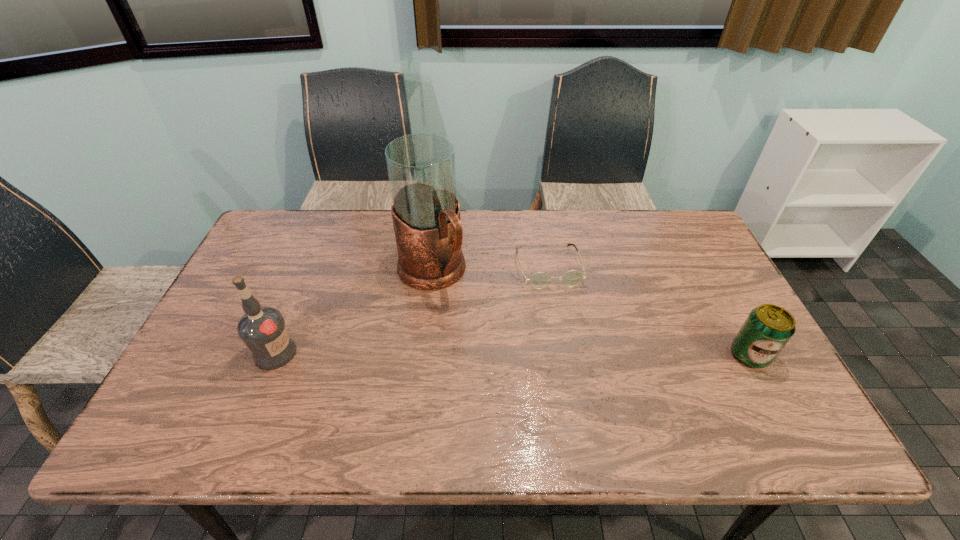
The image size is (960, 540). I want to click on free space located 0.330m with the handle on the side of the second object from left to right, so click(x=519, y=380).

Where is `vacant area located 0.280m with the handle on the side of the second object from left to right`? vacant area located 0.280m with the handle on the side of the second object from left to right is located at coordinates (507, 366).

Locate an element on the screen. free space located 0.270m with the handle on the side of the second object from left to right is located at coordinates (505, 363).

Image resolution: width=960 pixels, height=540 pixels. I want to click on vacant region located 0.090m on the lenses of the shortest object, so click(563, 313).

Identify the location of vacant space located on the lenses of the shortest object. The width and height of the screenshot is (960, 540). (578, 368).

Where is `vacant point located on the lenses of the shortest object`? vacant point located on the lenses of the shortest object is located at coordinates (576, 361).

Where is `pitcher at the far edge`? pitcher at the far edge is located at coordinates (425, 211).

At what (x,y) coordinates should I click in order to perform the action: click on spectacles at the far edge. Please return your answer as a coordinate pair (x, y). The width and height of the screenshot is (960, 540). Looking at the image, I should click on (539, 280).

The width and height of the screenshot is (960, 540). In order to click on object located at the left edge in this screenshot , I will do `click(262, 329)`.

Where is `object that is positioned at the right edge`? object that is positioned at the right edge is located at coordinates (767, 329).